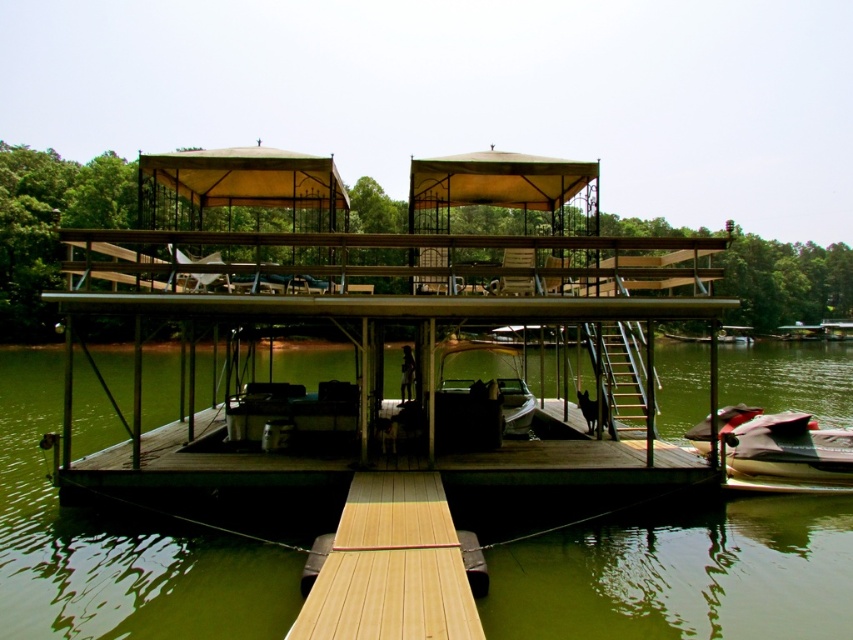
Question: Is green water at center smaller than light brown wood at center?

Choices:
 (A) yes
 (B) no

Answer: (B)

Question: Can you confirm if light brown wood at center is positioned above white rubber jet ski at lower right?

Choices:
 (A) no
 (B) yes

Answer: (B)

Question: Can you confirm if light brown wood at center is thinner than white rubber jet ski at lower right?

Choices:
 (A) no
 (B) yes

Answer: (A)

Question: Which of these objects is positioned closest to the light brown wood at center?

Choices:
 (A) green water at center
 (B) white rubber jet ski at lower right

Answer: (B)

Question: Which object is the farthest from the green water at center?

Choices:
 (A) light brown wood at center
 (B) white rubber jet ski at lower right

Answer: (B)

Question: Estimate the real-world distances between objects in this image. Which object is closer to the green water at center?

Choices:
 (A) light brown wood at center
 (B) white rubber jet ski at lower right

Answer: (A)